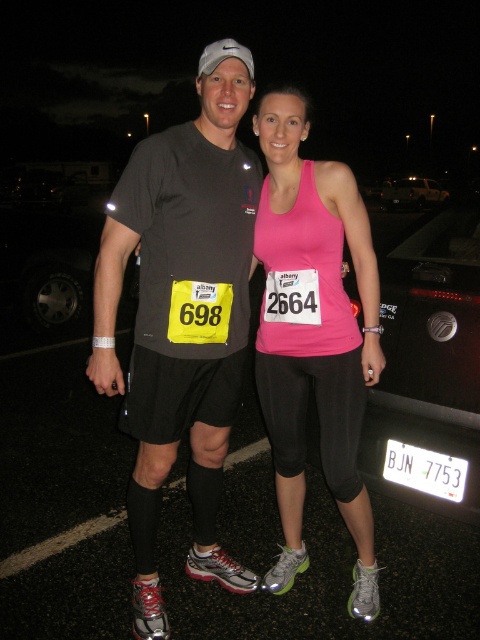
You are a photographer trying to capture a clear shot of the pink matte tank top at center and the black matte car at center. Since the tank top is in front, will the car be visible in the background?

The pink matte tank top at center is in front of the black matte car at center, so the car will be visible in the background behind the tank top.

You are a photographer setting up a camera at eye level with the pink matte tank top at center and the black matte car at center. Which object will appear taller in the photo?

The pink matte tank top at center will appear taller in the photo because it has a greater height compared to the black matte car at center according to the description.